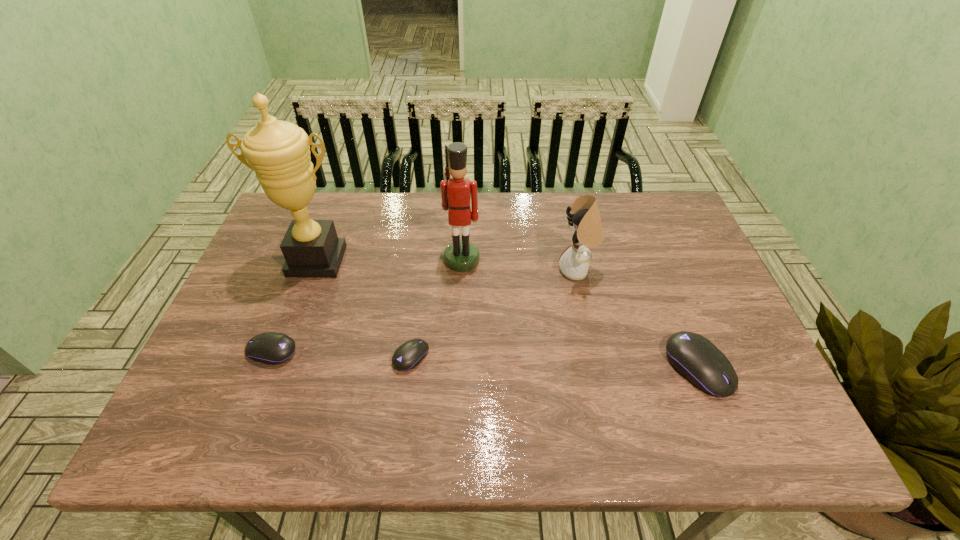
I want to click on trophy cup situated at the left edge, so 278,152.

This screenshot has height=540, width=960. Identify the location of object that is at the right edge. (697, 359).

Locate an element on the screen. This screenshot has width=960, height=540. object present at the near right corner is located at coordinates (697, 359).

Identify the location of vacant space at the far edge of the desktop. The height and width of the screenshot is (540, 960). (609, 218).

In the image, there is a desktop. Where is `vacant space at the near edge`? vacant space at the near edge is located at coordinates (524, 405).

Identify the location of free space at the left edge. (240, 314).

Identify the location of free space at the right edge of the desktop. (676, 247).

You are a GUI agent. You are given a task and a screenshot of the screen. Output one action in this format:
    pyautogui.click(x=<x>, y=<y>)
    Task: Click on the vacant region at the near left corner of the desktop
    The height and width of the screenshot is (540, 960).
    Given the screenshot: What is the action you would take?
    pyautogui.click(x=246, y=392)

The width and height of the screenshot is (960, 540). I want to click on free location at the far right corner of the desktop, so click(x=645, y=202).

I want to click on vacant region at the near right corner of the desktop, so click(747, 388).